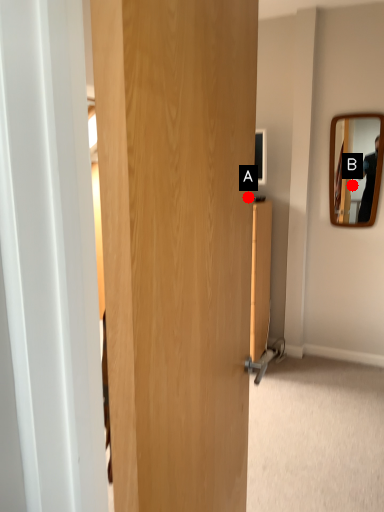
Question: Two points are circled on the image, labeled by A and B beside each circle. Which point is farther from the camera taking this photo?

Choices:
 (A) A is further
 (B) B is further

Answer: (B)